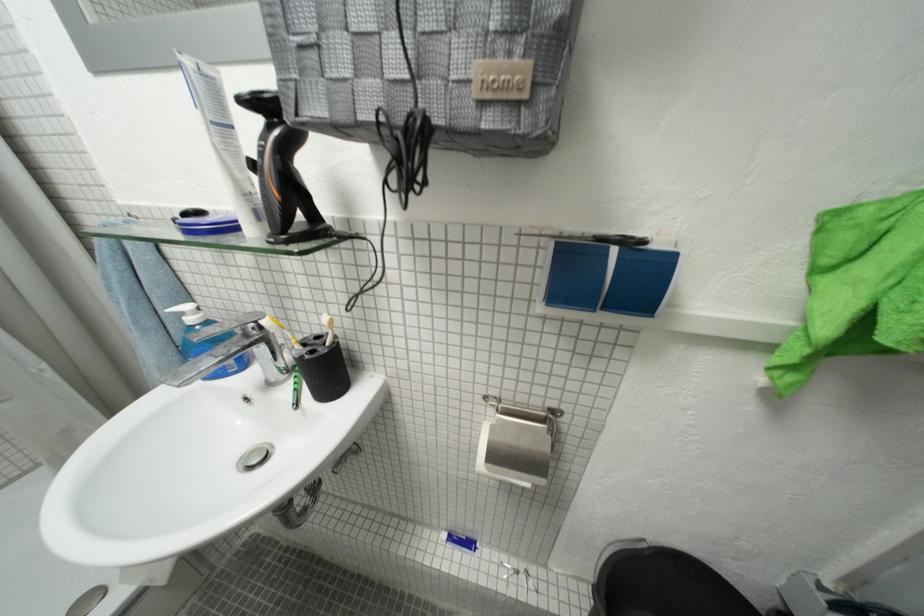
At what (x,y) coordinates should I click in order to perform the action: click on black handle scissors. Please return your answer as a coordinate pair (x, y). Looking at the image, I should click on (621, 238).